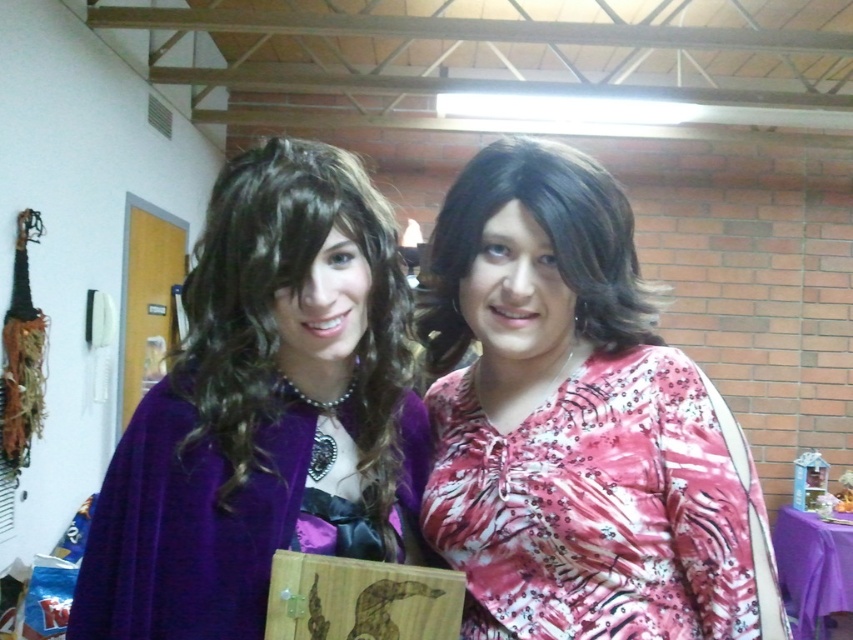
From the picture: Can you confirm if pink sequined blouse at center is taller than shiny brown wig at center?

Correct, pink sequined blouse at center is much taller as shiny brown wig at center.

Where is `pink sequined blouse at center`? This screenshot has width=853, height=640. pink sequined blouse at center is located at coordinates (570, 419).

Consider the image. Can you confirm if velvet purple cape at left is thinner than shiny brown wig at center?

No.

This screenshot has width=853, height=640. Identify the location of velvet purple cape at left. (265, 410).

Can you confirm if pink sequined blouse at center is smaller than velvet purple cape at left?

No.

Is point (589, 193) positioned after point (421, 547)?

No, it is not.

Between point (625, 448) and point (144, 445), which one is positioned behind?

The point (625, 448) is behind.

This screenshot has height=640, width=853. Find the location of `pink sequined blouse at center`. pink sequined blouse at center is located at coordinates (570, 419).